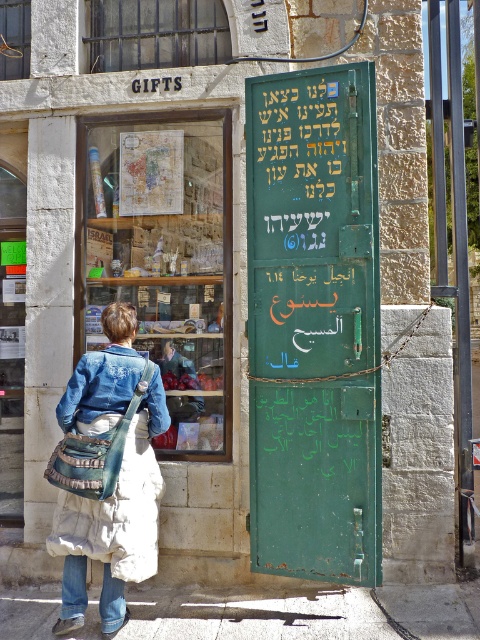
You are a customer in the GIFTS store and want to place a small gift box between the denim jacket at lower right and the denim jeans at lower left. Can you fit it there?

The denim jacket at lower right might be wider than denim jeans at lower left, so there might be enough space to place the small gift box between them.

You are a customer browsing the GIFTS store window and notice two items displayed in the window. The denim jacket at lower right and the denim jeans at lower left. Which item is positioned higher in the window?

The denim jacket at lower right is located above the denim jeans at lower left, so the denim jacket at lower right is positioned higher in the window.